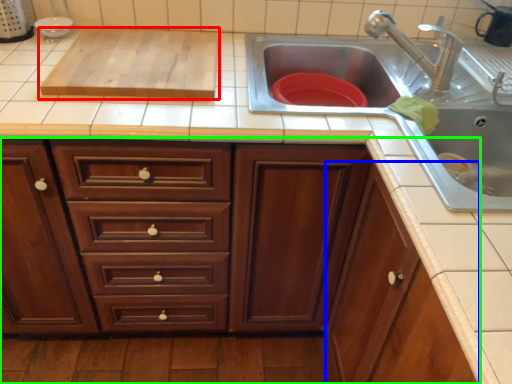
Question: Estimate the real-world distances between objects in this image. Which object is farther from wide (highlighted by a red box), cabinetry (highlighted by a blue box) or cabinetry (highlighted by a green box)?

Choices:
 (A) cabinetry
 (B) cabinetry

Answer: (A)